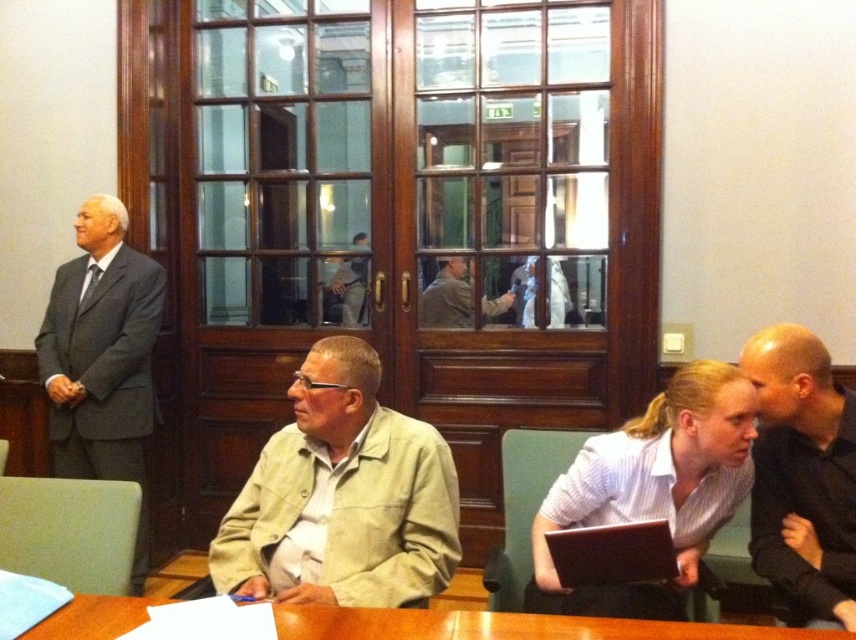
Question: Considering the real-world distances, which object is farthest from the dark gray suit at left?

Choices:
 (A) khaki cotton shirt at center
 (B) black matte shirt at right
 (C) brown wooden table at lower center

Answer: (B)

Question: Observing the image, what is the correct spatial positioning of beige fabric jacket at center in reference to white striped shirt at lower right?

Choices:
 (A) above
 (B) below

Answer: (A)

Question: Which point is closer to the camera taking this photo?

Choices:
 (A) (623, 570)
 (B) (654, 637)
 (C) (635, 442)

Answer: (B)

Question: Which is farther from the brown wooden table at lower center?

Choices:
 (A) khaki fabric jacket at center
 (B) khaki cotton shirt at center
 (C) white striped shirt at lower right
 (D) dark gray suit at left

Answer: (B)

Question: Is brown wooden table at lower center below khaki fabric jacket at center?

Choices:
 (A) yes
 (B) no

Answer: (A)

Question: Can you confirm if dark gray suit at left is positioned to the right of khaki cotton shirt at center?

Choices:
 (A) yes
 (B) no

Answer: (B)